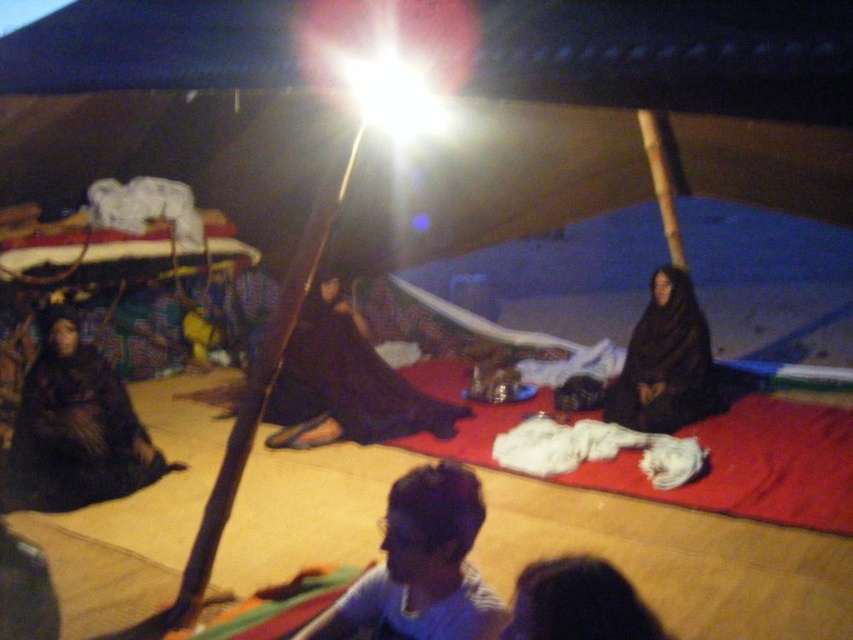
Question: From the image, what is the correct spatial relationship of black fabric at center in relation to black matte dress at center?

Choices:
 (A) right
 (B) left

Answer: (B)

Question: Does black matte dress at left have a larger size compared to blue fabric shirt at center?

Choices:
 (A) yes
 (B) no

Answer: (A)

Question: Which of the following is the farthest from the observer?

Choices:
 (A) (316, 298)
 (B) (438, 477)
 (C) (666, 380)

Answer: (A)

Question: Can you confirm if black fabric at center is wider than black matte dress at center?

Choices:
 (A) yes
 (B) no

Answer: (A)

Question: Which point is farther to the camera?

Choices:
 (A) blue fabric shirt at center
 (B) black matte dress at center
 (C) black fabric at center
 (D) black matte dress at left

Answer: (C)

Question: Which of the following is the farthest from the observer?

Choices:
 (A) (457, 474)
 (B) (335, 368)
 (C) (683, 413)

Answer: (B)